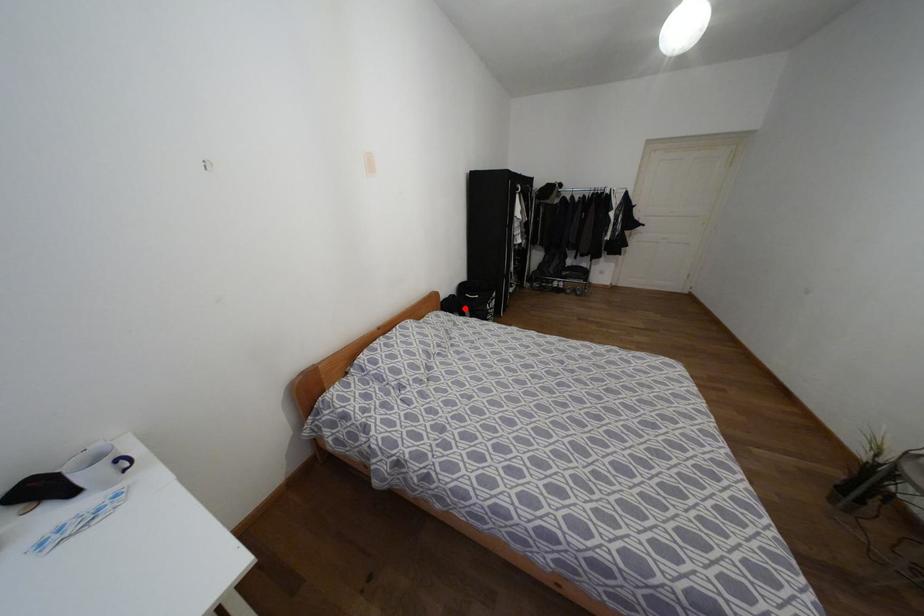
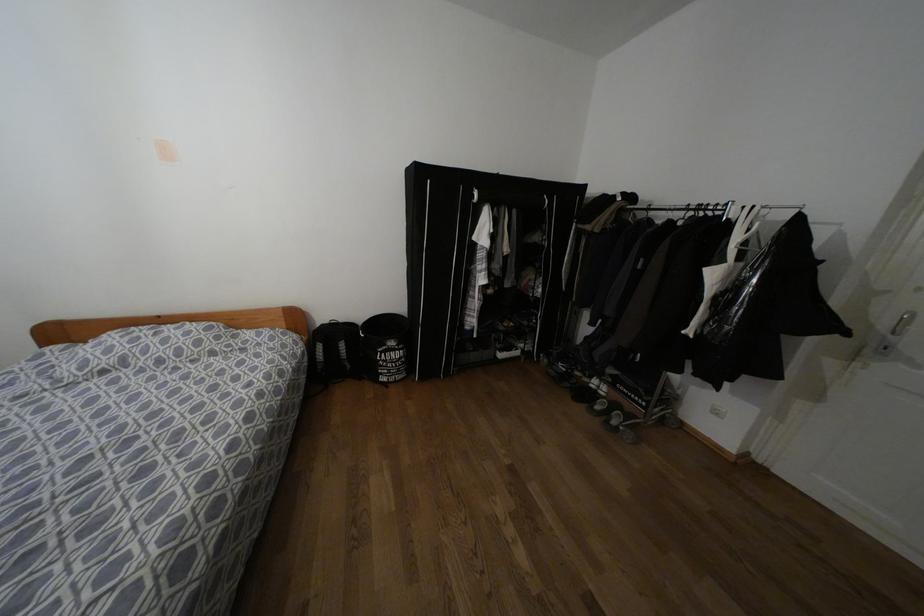
Question: I am providing you with two images of the same scene from different viewpoints. Given a red point in image1, look at the same physical point in image2. Is it:

Choices:
 (A) Closer to the viewpoint
 (B) Farther from the viewpoint

Answer: (B)